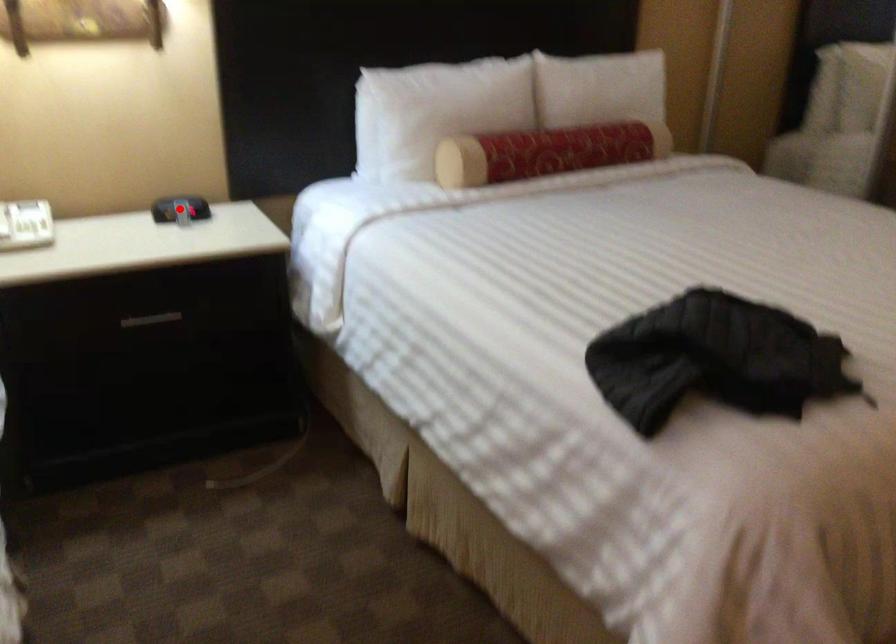
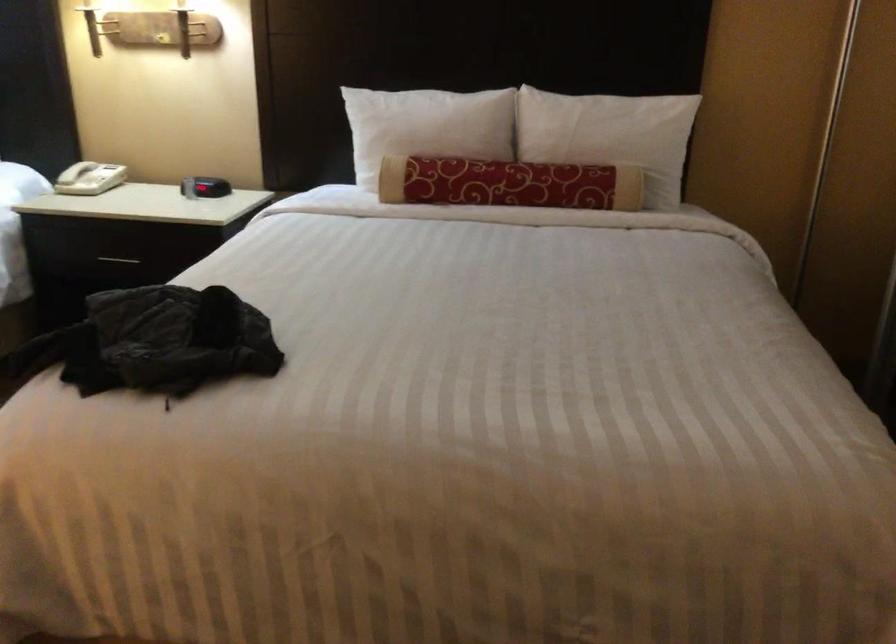
Question: I am providing you with two images of the same scene from different viewpoints. A red point is shown in image1. For the corresponding object point in image2, is it positioned nearer or farther from the camera?

Choices:
 (A) Nearer
 (B) Farther

Answer: (B)